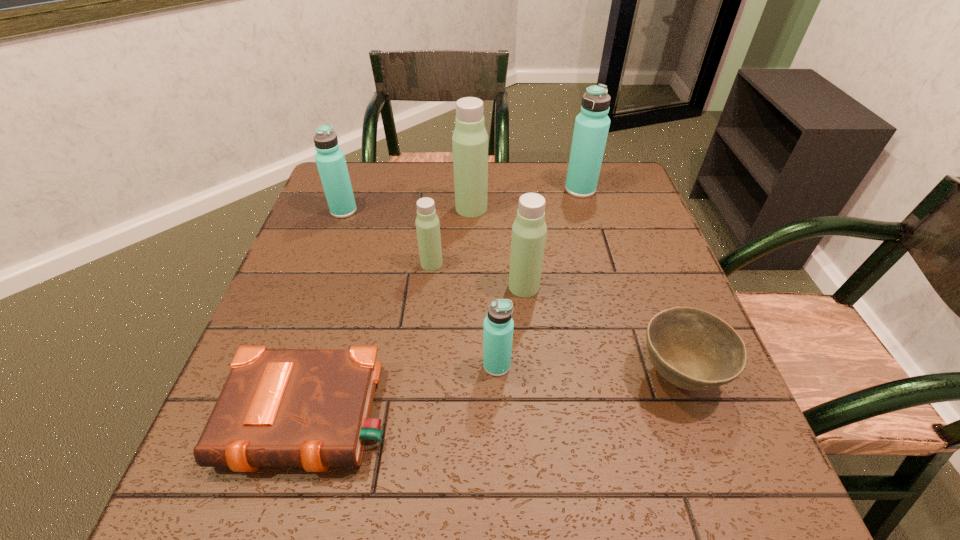
Identify the location of vacant area between the smallest aqua thermos bottle and the leftmost thermos bottle. (420, 288).

You are a GUI agent. You are given a task and a screenshot of the screen. Output one action in this format:
    pyautogui.click(x=<x>, y=<y>)
    Task: Click on the free space between the leftmost thermos bottle and the second thermos bottle from left to right
    This screenshot has height=540, width=960.
    Given the screenshot: What is the action you would take?
    pyautogui.click(x=388, y=237)

The image size is (960, 540). I want to click on free space that is in between the bowl and the smallest aqua thermos bottle, so click(x=588, y=370).

This screenshot has width=960, height=540. Find the location of `object that is the second closest to the leftmost aqua thermos bottle`. object that is the second closest to the leftmost aqua thermos bottle is located at coordinates (470, 139).

Locate which object is the fifth closest to the second nearest aqua thermos bottle. Please provide its 2D coordinates. Your answer should be formatted as a tuple, i.e. [(x, y)], where the tuple contains the x and y coordinates of a point satisfying the conditions above.

[(498, 328)]

Identify which thermos bottle is located as the nearest to the seventh tallest object. Please provide its 2D coordinates. Your answer should be formatted as a tuple, i.e. [(x, y)], where the tuple contains the x and y coordinates of a point satisfying the conditions above.

[(529, 229)]

Locate an element on the screen. thermos bottle that is the third closest one to the farthest aqua thermos bottle is located at coordinates (427, 223).

Locate an element on the screen. This screenshot has height=540, width=960. aqua thermos bottle that stands as the closest to the farthest thermos bottle is located at coordinates coord(498,328).

You are a GUI agent. You are given a task and a screenshot of the screen. Output one action in this format:
    pyautogui.click(x=<x>, y=<y>)
    Task: Click on the aqua thermos bottle that is the nearest to the sixth object from left to right
    The image size is (960, 540).
    Given the screenshot: What is the action you would take?
    pyautogui.click(x=498, y=328)

You are a GUI agent. You are given a task and a screenshot of the screen. Output one action in this format:
    pyautogui.click(x=<x>, y=<y>)
    Task: Click on the third closest light thermos bottle to the Bible
    
    Given the screenshot: What is the action you would take?
    pyautogui.click(x=470, y=139)